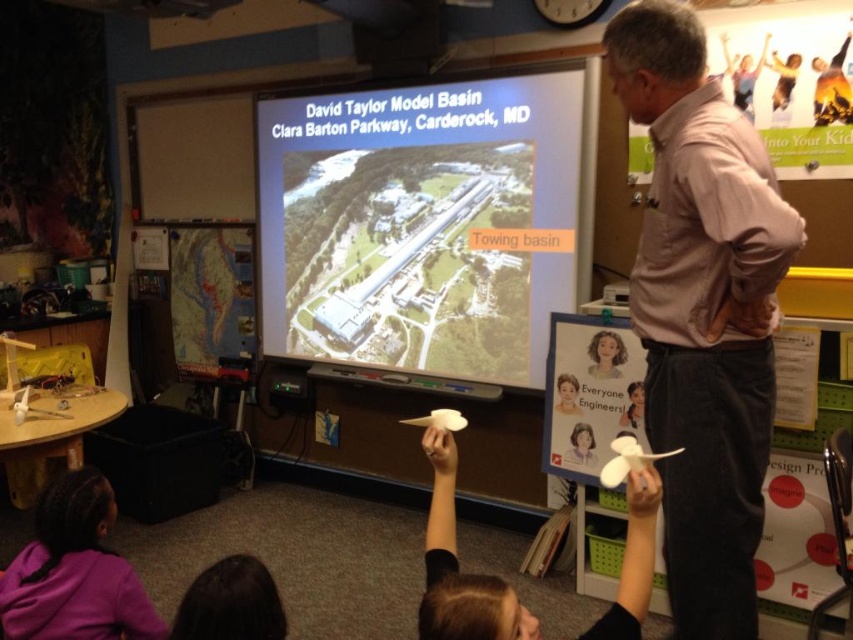
You are a student in the classroom looking at the purple fabric at lower left and the white paper airplane at center. Which object is closer to the bottom edge of the image?

The purple fabric at lower left is closer to the bottom edge of the image because it is located below the white paper airplane at center.

You are a student in the classroom and want to see both the matte white projector screen at center and the white paper airplane at center. Which one is positioned higher from the ground?

The matte white projector screen at center is located above the white paper airplane at center, so it is positioned higher from the ground.

Consider the image. You are a student in the classroom. You want to throw your white paper airplane at center to hit the matte black projector at upper center. Can you reach it from where you are standing?

The white paper airplane at center is 2.32 meters away from the matte black projector at upper center. Since the average throwing distance for a paper airplane is around 20 feet or about 6 meters, you should be able to reach the matte black projector at upper center with a strong throw.